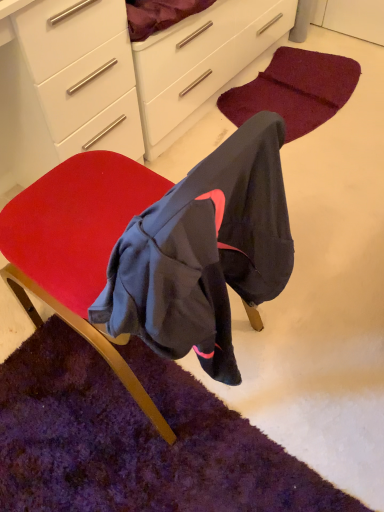
Question: Is burgundy carpet at lower center, which is counted as the second mat, starting from the front, to the left of velvet red chair at center from the viewer's perspective?

Choices:
 (A) no
 (B) yes

Answer: (A)

Question: Considering the relative sizes of burgundy carpet at lower center, the 2th mat from the bottom, and velvet red chair at center in the image provided, is burgundy carpet at lower center, the 2th mat from the bottom, taller than velvet red chair at center?

Choices:
 (A) yes
 (B) no

Answer: (B)

Question: Are burgundy carpet at lower center, which is counted as the second mat, starting from the front, and velvet red chair at center far apart?

Choices:
 (A) yes
 (B) no

Answer: (A)

Question: Can you confirm if burgundy carpet at lower center, which is counted as the 1th mat, starting from the back, is shorter than velvet red chair at center?

Choices:
 (A) no
 (B) yes

Answer: (B)

Question: Is burgundy carpet at lower center, the 2th mat from the bottom, to the right of velvet red chair at center from the viewer's perspective?

Choices:
 (A) no
 (B) yes

Answer: (B)

Question: From the image's perspective, would you say burgundy carpet at lower center, arranged as the first mat when viewed from the top, is shown under velvet red chair at center?

Choices:
 (A) no
 (B) yes

Answer: (A)

Question: Is white glossy chest of drawers at upper left positioned beyond the bounds of white glossy cabinet at upper center?

Choices:
 (A) no
 (B) yes

Answer: (B)

Question: Is white glossy chest of drawers at upper left wider than white glossy cabinet at upper center?

Choices:
 (A) no
 (B) yes

Answer: (B)

Question: Does white glossy chest of drawers at upper left touch white glossy cabinet at upper center?

Choices:
 (A) yes
 (B) no

Answer: (A)

Question: Is white glossy chest of drawers at upper left to the right of white glossy cabinet at upper center from the viewer's perspective?

Choices:
 (A) yes
 (B) no

Answer: (B)

Question: Does white glossy chest of drawers at upper left turn towards white glossy cabinet at upper center?

Choices:
 (A) no
 (B) yes

Answer: (A)

Question: From a real-world perspective, is white glossy chest of drawers at upper left physically below white glossy cabinet at upper center?

Choices:
 (A) yes
 (B) no

Answer: (B)

Question: Is white glossy cabinet at upper center not near white glossy chest of drawers at upper left?

Choices:
 (A) no
 (B) yes

Answer: (A)